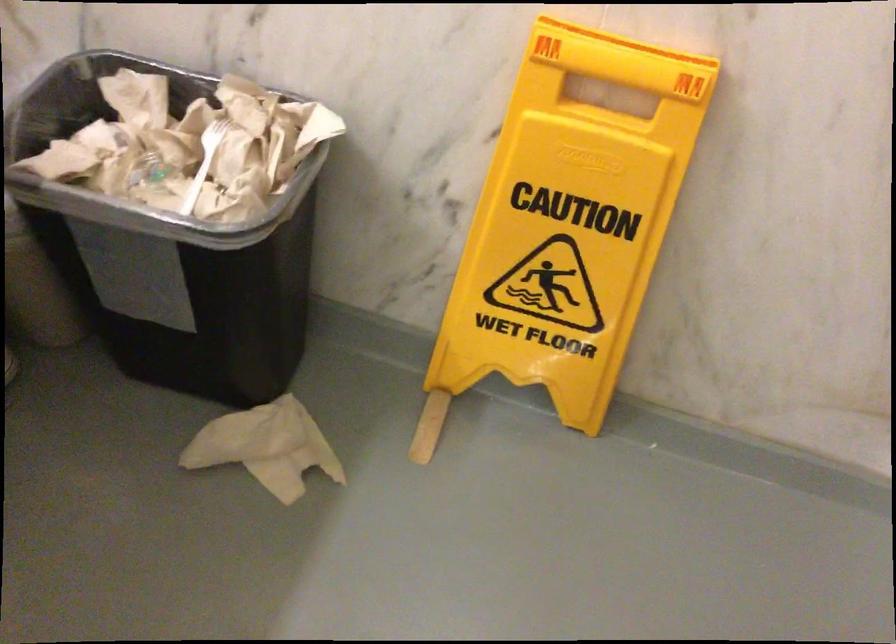
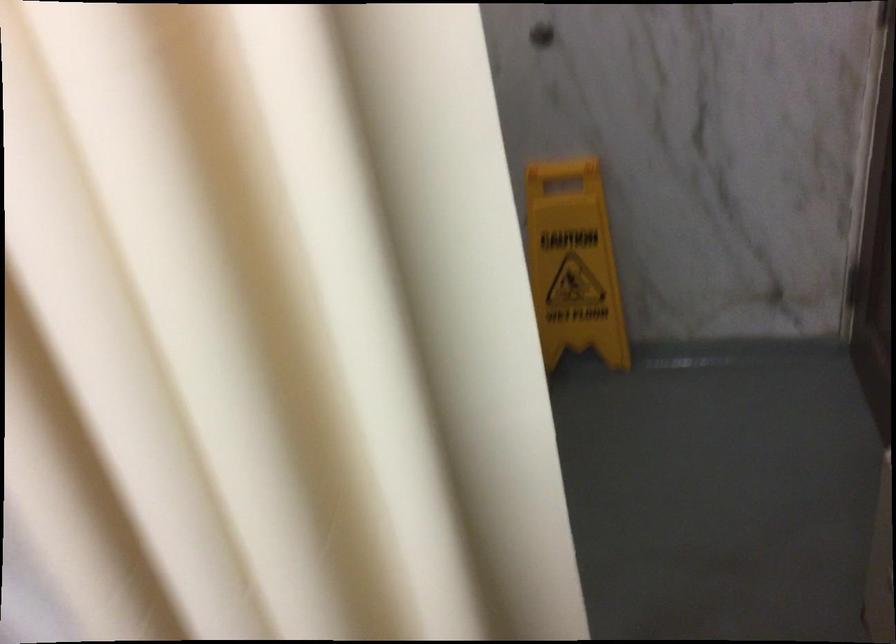
Question: Which direction would the cameraman need to move to produce the second image? Reply with the corresponding letter.

Choices:
 (A) Left
 (B) Right
 (C) Forward
 (D) Backward

Answer: (D)